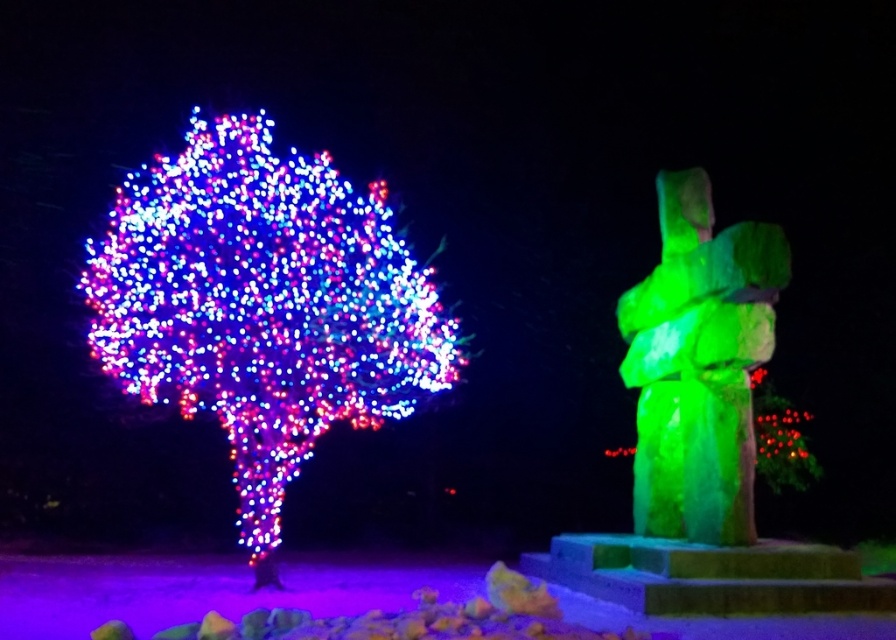
Does illuminated plastic tree at left come behind green stone statue at right?

That is False.

Is illuminated plastic tree at left bigger than green stone statue at right?

Yes, illuminated plastic tree at left is bigger than green stone statue at right.

Between point (285, 204) and point (672, 484), which one is positioned behind?

Positioned behind is point (672, 484).

Identify the location of illuminated plastic tree at left. (263, 304).